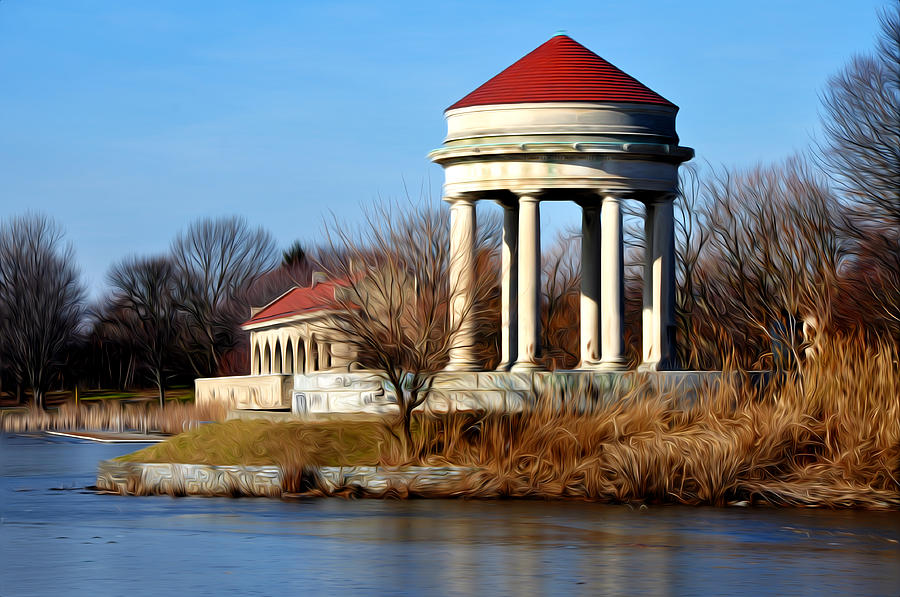
Find the location of a particular element. This screenshot has height=597, width=900. wall is located at coordinates (253, 476), (190, 473), (159, 473).